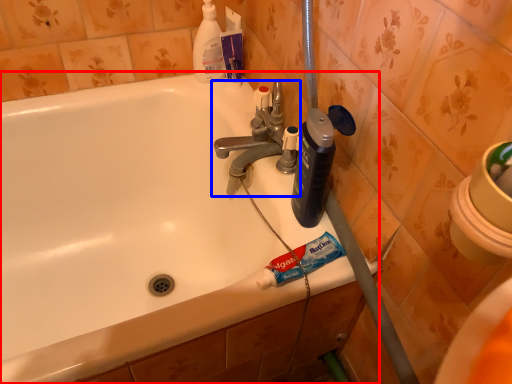
Question: Which object is further to the camera taking this photo, bathtub (highlighted by a red box) or tap (highlighted by a blue box)?

Choices:
 (A) bathtub
 (B) tap

Answer: (B)